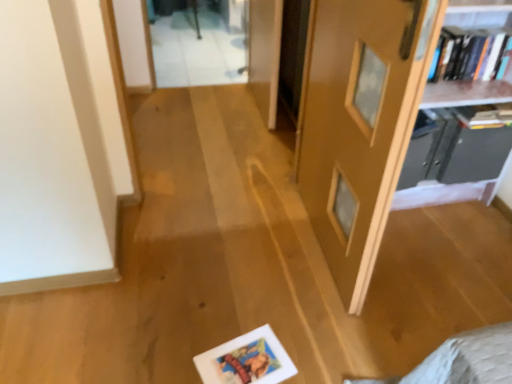
Locate an element on the screen. This screenshot has height=384, width=512. vacant space in between matte wooden door at center and white matte picture frame at lower center is located at coordinates (276, 280).